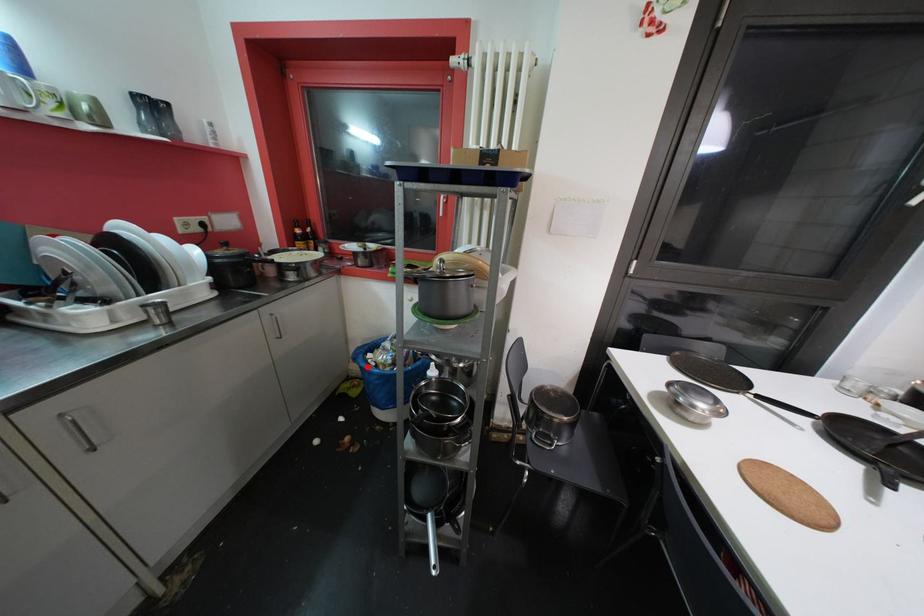
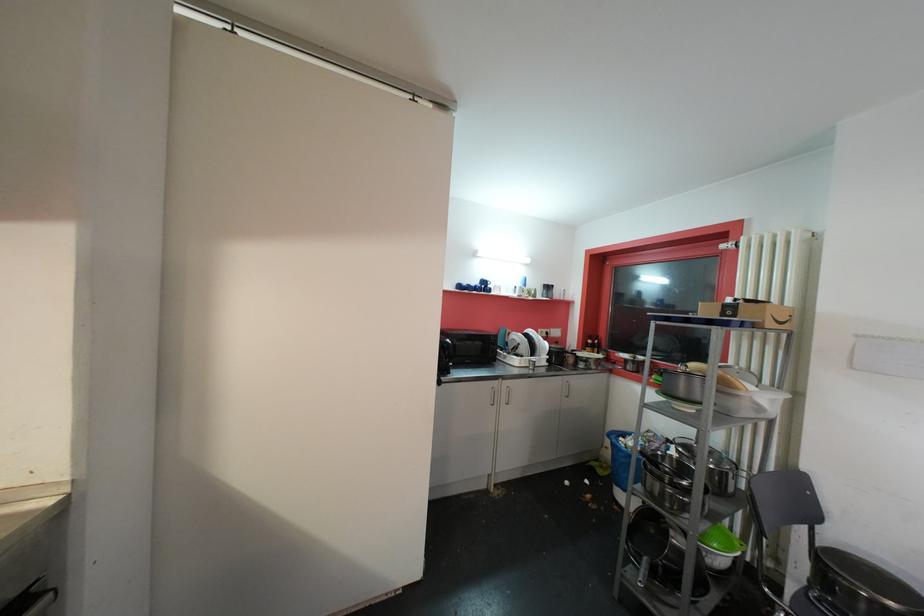
Question: I am providing you with two images of the same scene from different viewpoints. A red point is shown in image1. For the corresponding object point in image2, is it positioned nearer or farther from the camera?

Choices:
 (A) Nearer
 (B) Farther

Answer: (A)